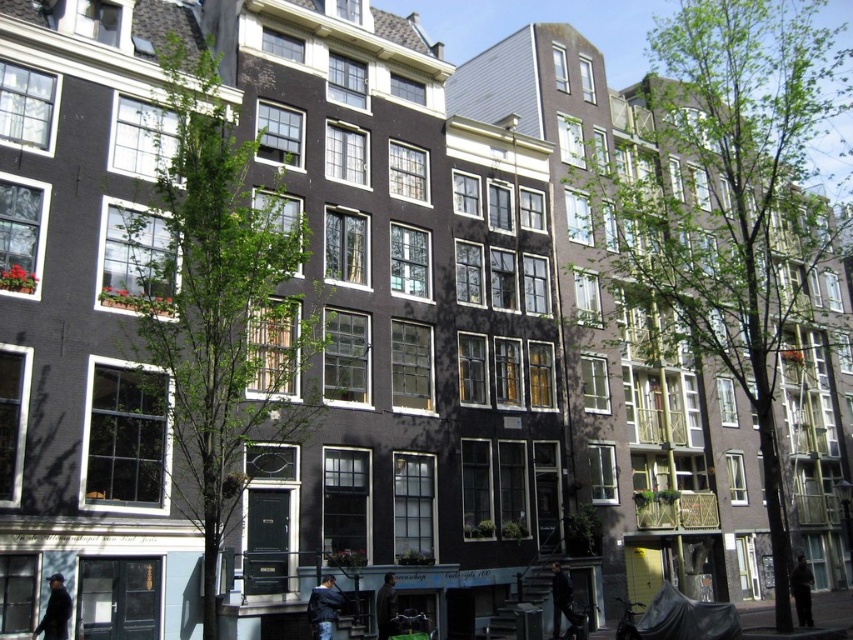
Question: Among these points, which one is farthest from the camera?

Choices:
 (A) (61, 618)
 (B) (381, 593)
 (C) (553, 568)
 (D) (334, 608)

Answer: (C)

Question: Can you confirm if dark blue jacket at lower left is bigger than dark gray jacket at lower center?

Choices:
 (A) no
 (B) yes

Answer: (B)

Question: Is dark blue leather jacket at lower center to the right of dark brown leather jacket at lower right from the viewer's perspective?

Choices:
 (A) no
 (B) yes

Answer: (A)

Question: Which of the following is the closest to the observer?

Choices:
 (A) dark brown leather jacket at lower center
 (B) dark brown leather jacket at lower right

Answer: (A)

Question: Does dark blue jacket at lower left appear on the right side of dark brown leather jacket at lower right?

Choices:
 (A) no
 (B) yes

Answer: (A)

Question: Which object is closer to the camera taking this photo?

Choices:
 (A) dark brown leather jacket at lower right
 (B) dark brown leather jacket at lower center
 (C) dark blue jacket at lower left

Answer: (C)